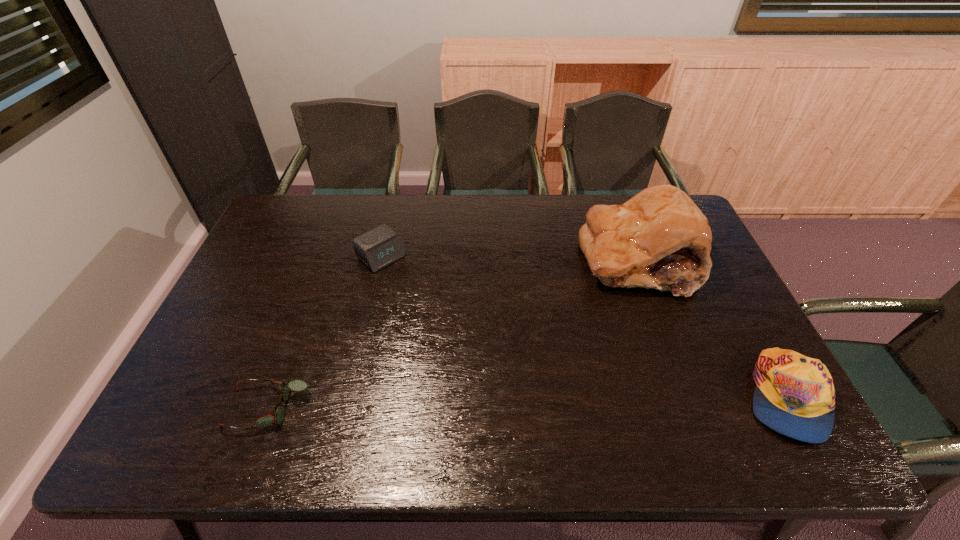
Locate an element on the screen. free space on the desktop that is between the leftmost object and the cap and is positioned on the filling side of the tallest object is located at coordinates (540, 402).

You are a GUI agent. You are given a task and a screenshot of the screen. Output one action in this format:
    pyautogui.click(x=<x>, y=<y>)
    Task: Click on the vacant space on the desktop that is between the shortest object and the cap and is positioned on the front-facing side of the third tallest object
    The height and width of the screenshot is (540, 960).
    Given the screenshot: What is the action you would take?
    pyautogui.click(x=547, y=402)